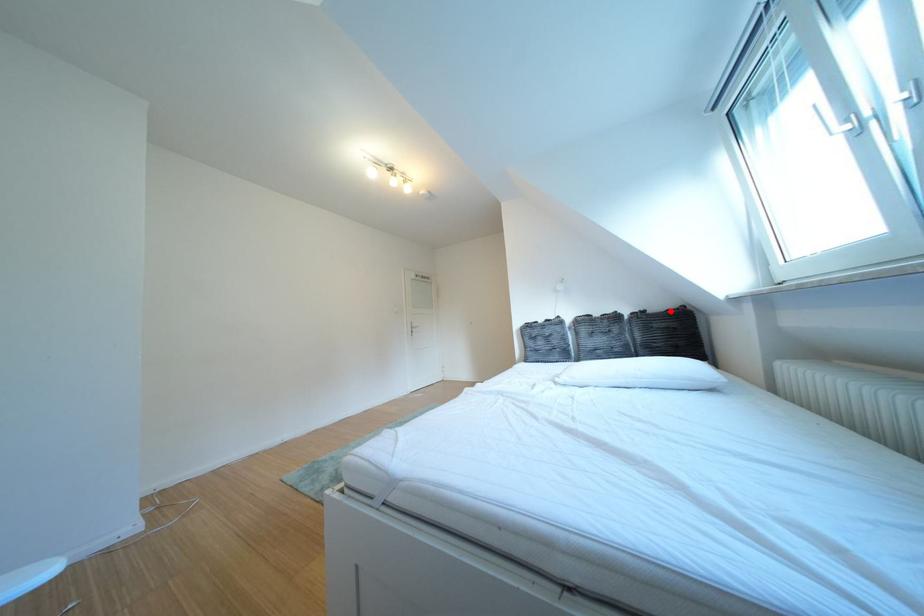
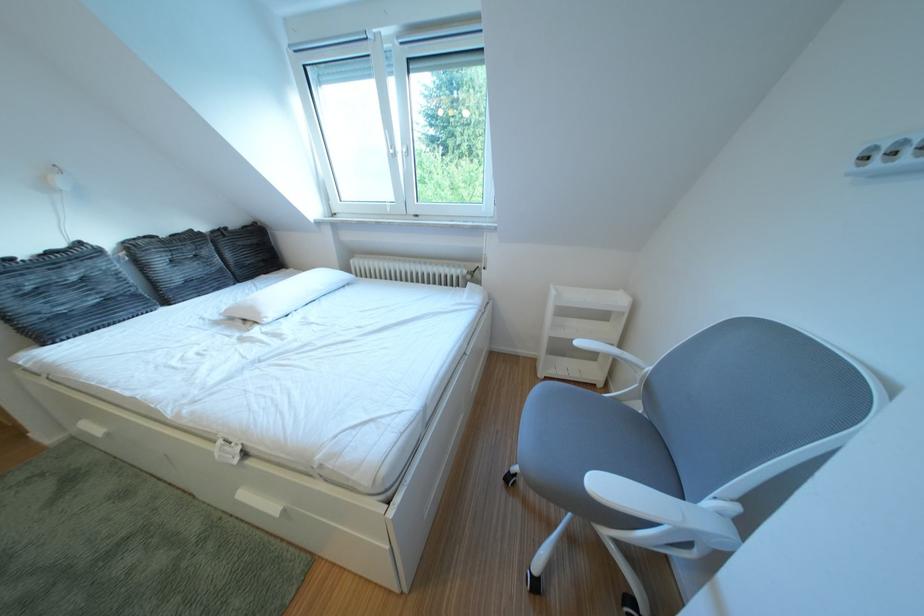
Locate, in the second image, the point that corresponds to the highlighted location in the first image.

(247, 228)